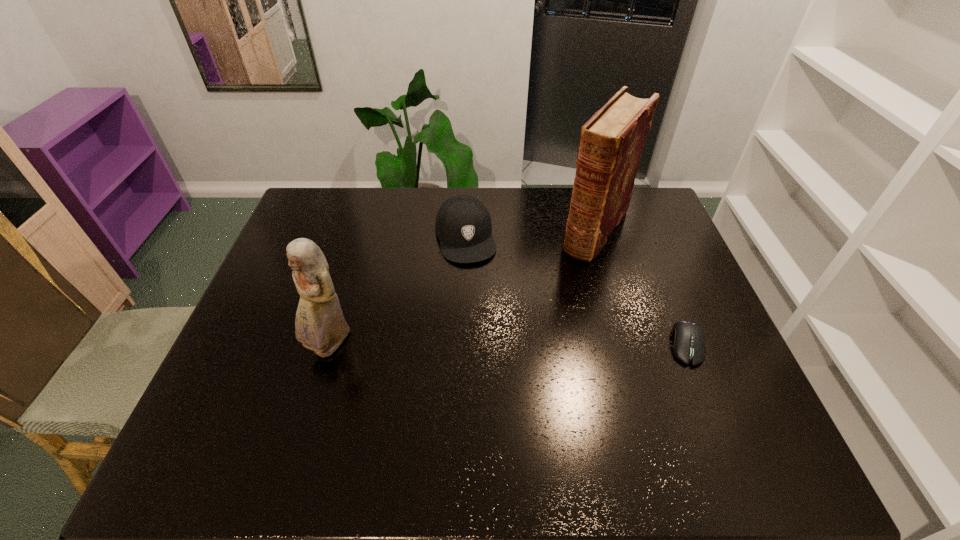
Locate an element on the screen. Image resolution: width=960 pixels, height=540 pixels. figurine is located at coordinates (320, 326).

This screenshot has width=960, height=540. I want to click on the second tallest object, so click(x=320, y=326).

The width and height of the screenshot is (960, 540). I want to click on computer equipment, so click(688, 338).

In order to click on the tallest object in this screenshot , I will do coord(611,143).

In order to click on the second shortest object in this screenshot , I will do `click(463, 225)`.

Identify the location of the third object from right to left. (463, 225).

At what (x,y) coordinates should I click in order to perform the action: click on free space located 0.050m on the front-facing side of the leftmost object. Please return your answer as a coordinate pair (x, y). The image size is (960, 540). Looking at the image, I should click on pyautogui.click(x=319, y=384).

Where is `blank area located 0.110m on the back of the shortest object`? blank area located 0.110m on the back of the shortest object is located at coordinates (666, 293).

Identify the location of vacant point located on the spine side of the hardback book. tap(571, 272).

Where is `vacant region located on the spine side of the hardback book`? The image size is (960, 540). vacant region located on the spine side of the hardback book is located at coordinates (563, 284).